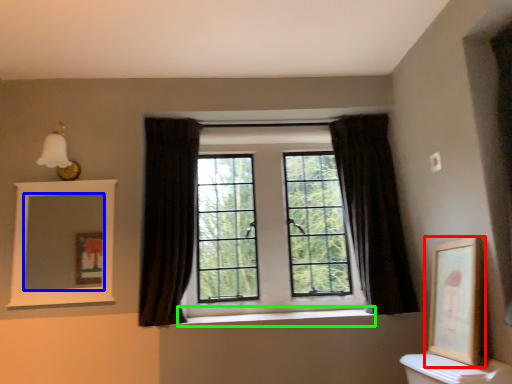
Question: Which object is positioned closest to picture frame (highlighted by a red box)? Select from mirror (highlighted by a blue box) and window sill (highlighted by a green box).

Choices:
 (A) mirror
 (B) window sill

Answer: (B)